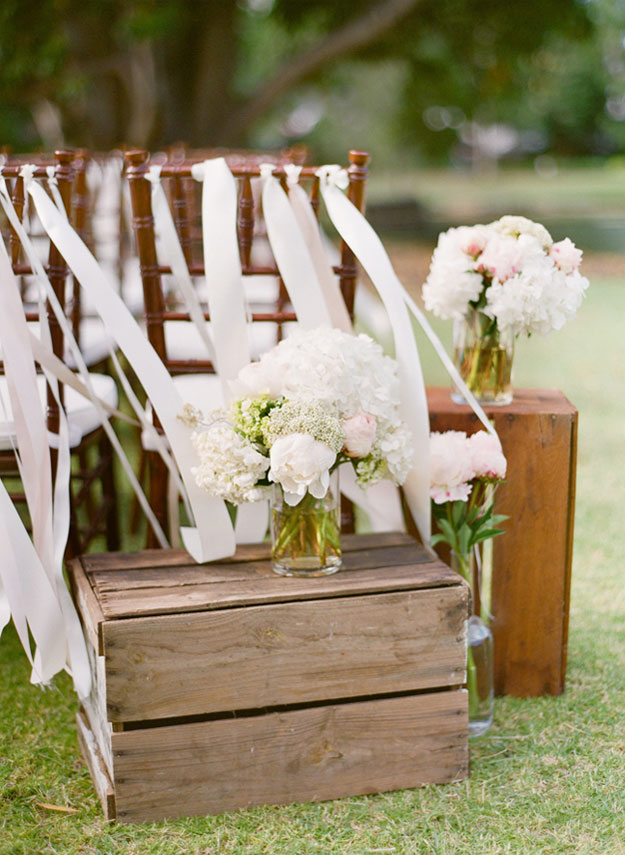
Locate an element on the screen. vase is located at coordinates (481, 651), (487, 357), (310, 532).